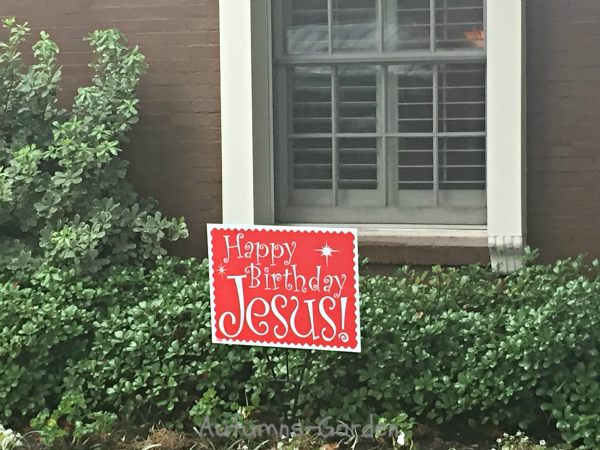
Where is `shutters`? shutters is located at coordinates (320, 102).